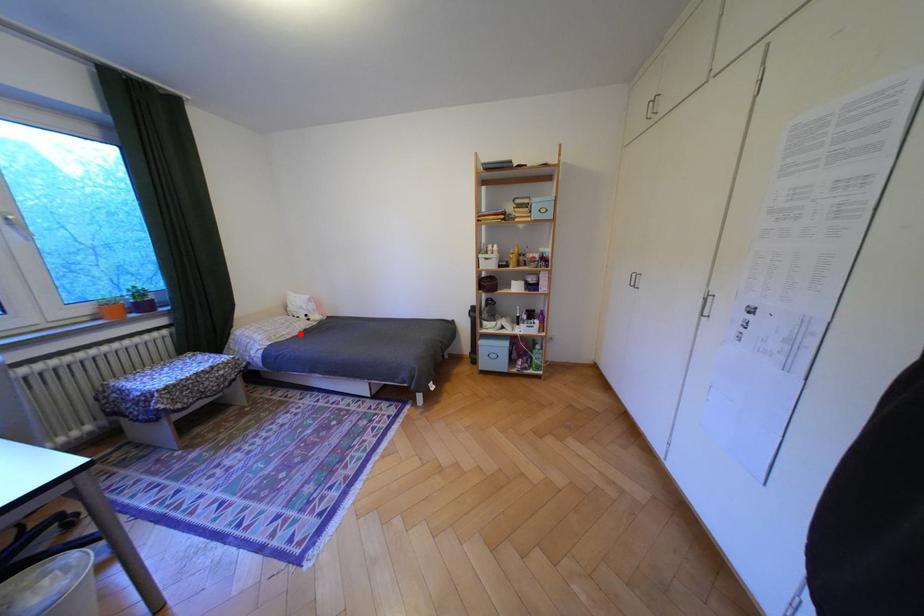
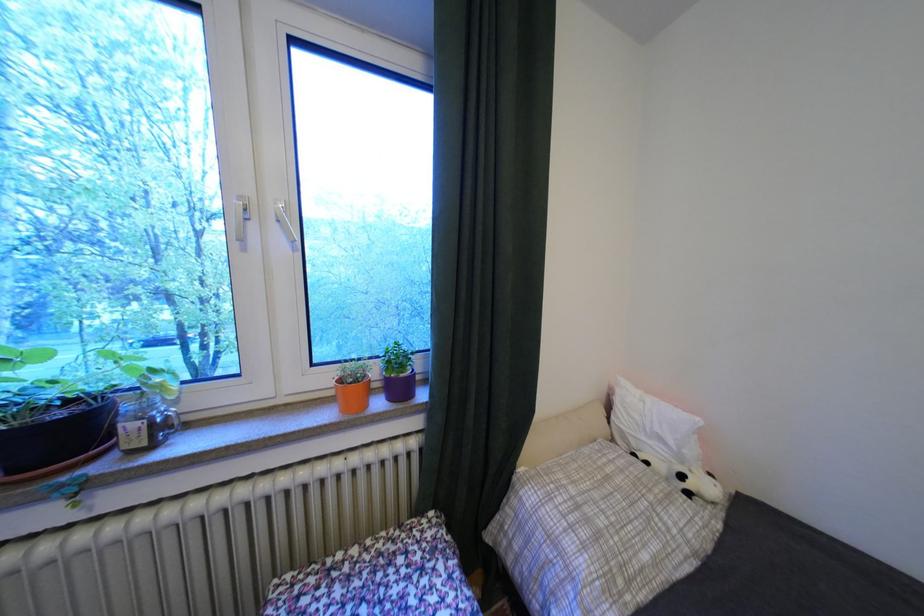
Question: I am providing you with two images of the same scene from different viewpoints. A red point is marked on the first image. Can you still see the location of the red point in image 2?

Choices:
 (A) Yes
 (B) No

Answer: (A)